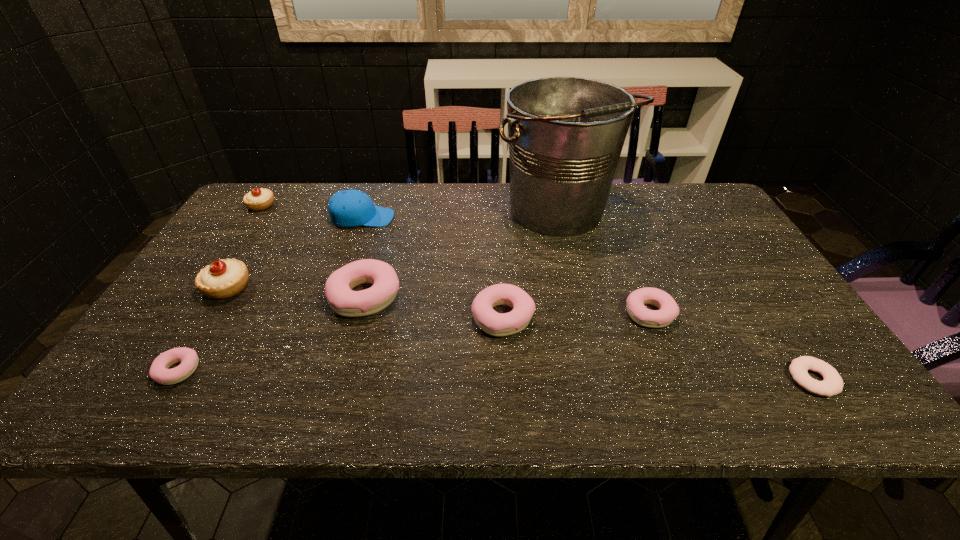
Select which pastry is the second closest to the blue cap. Please provide its 2D coordinates. Your answer should be formatted as a tuple, i.e. [(x, y)], where the tuple contains the x and y coordinates of a point satisfying the conditions above.

[(344, 301)]

At what (x,y) coordinates should I click in order to perform the action: click on pink pastry that stands as the closest to the tallest pastry. Please return your answer as a coordinate pair (x, y). The width and height of the screenshot is (960, 540). Looking at the image, I should click on (159, 372).

I want to click on pink pastry that is the third closest to the doughnut, so click(x=344, y=301).

Locate an element on the screen. vacant region that satisfies the following two spatial constraints: 1. on the front side of the rightmost pastry; 2. on the right side of the farthest pastry is located at coordinates (189, 313).

Locate an element on the screen. This screenshot has width=960, height=540. free space that satisfies the following two spatial constraints: 1. on the front side of the shortest object; 2. on the left side of the second shortest object is located at coordinates (172, 380).

Find the location of a particular element. The width and height of the screenshot is (960, 540). free space in the image that satisfies the following two spatial constraints: 1. on the front side of the second pink pastry from right to left; 2. on the left side of the farthest pastry is located at coordinates (186, 317).

The width and height of the screenshot is (960, 540). I want to click on free space that satisfies the following two spatial constraints: 1. on the front-facing side of the doughnut; 2. on the left side of the cap, so click(306, 380).

Locate an element on the screen. free spot that satisfies the following two spatial constraints: 1. on the front-facing side of the cap; 2. on the front side of the nearer beige pastry is located at coordinates 338,287.

This screenshot has width=960, height=540. Identify the location of vacant region that satisfies the following two spatial constraints: 1. on the front-facing side of the cap; 2. on the right side of the second pastry from right to left. (328, 317).

Identify the location of free space that satisfies the following two spatial constraints: 1. on the front-facing side of the fourth shortest object; 2. on the left side of the cap. The width and height of the screenshot is (960, 540). (328, 317).